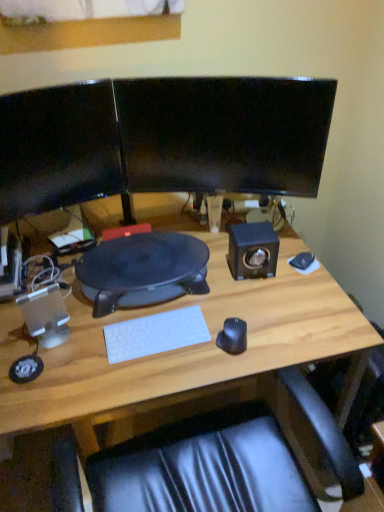
Find the location of `free location to the right of black rubberized desk at center`. free location to the right of black rubberized desk at center is located at coordinates (256, 290).